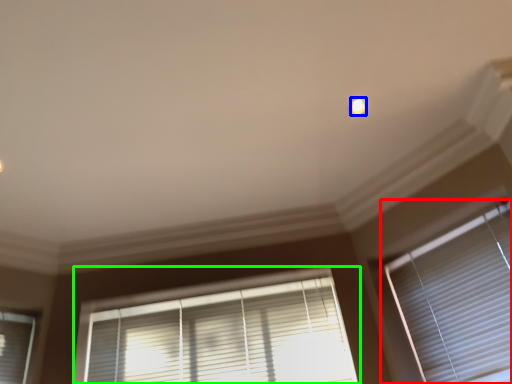
Question: Considering the real-world distances, which object is closest to window blind (highlighted by a red box)? light (highlighted by a blue box) or window blind (highlighted by a green box).

Choices:
 (A) light
 (B) window blind

Answer: (B)